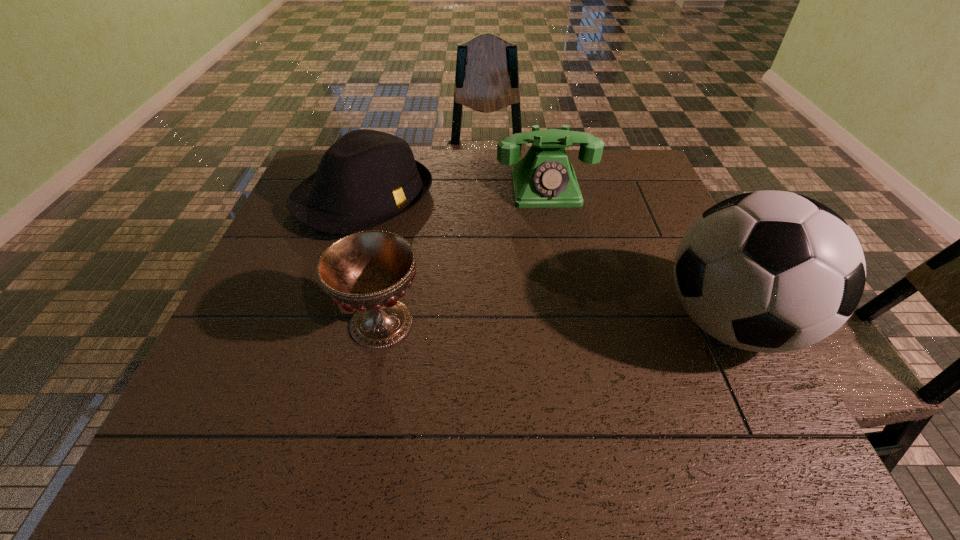
Where is `vacant space on the desktop that is between the chalice and the rightmost object and is positioned on the dial of the telephone`? The image size is (960, 540). vacant space on the desktop that is between the chalice and the rightmost object and is positioned on the dial of the telephone is located at coordinates (575, 323).

Identify the location of free space on the desktop that is between the chalice and the soccer ball and is positioned on the front-facing side of the fedora. Image resolution: width=960 pixels, height=540 pixels. (581, 323).